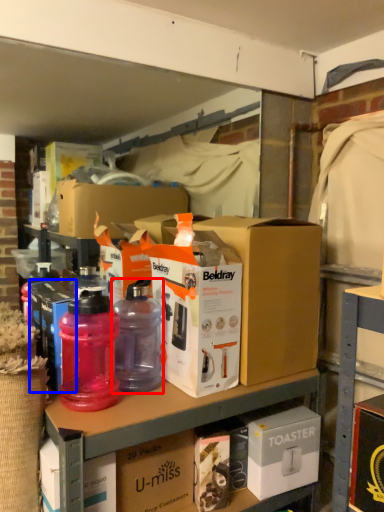
Question: Which object is further to the camera taking this photo, bottle (highlighted by a red box) or box (highlighted by a blue box)?

Choices:
 (A) bottle
 (B) box

Answer: (B)